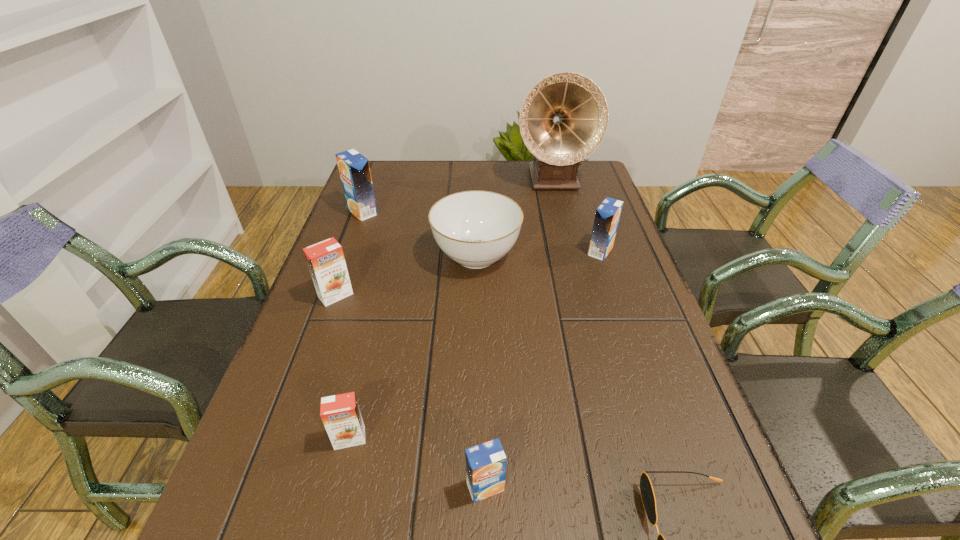
Locate an element on the screen. object that is at the far edge is located at coordinates (563, 119).

Where is `phonograph record at the right edge`? The image size is (960, 540). phonograph record at the right edge is located at coordinates (563, 119).

The width and height of the screenshot is (960, 540). What are the coordinates of `orange_juice that is at the right edge` in the screenshot? It's located at (607, 216).

Locate an element on the screen. The width and height of the screenshot is (960, 540). object present at the far right corner is located at coordinates (563, 119).

I want to click on vacant space at the far edge of the desktop, so click(x=416, y=170).

The image size is (960, 540). In the image, there is a desktop. What are the coordinates of `free space at the left edge` in the screenshot? It's located at (319, 422).

Where is `free space at the right edge`? This screenshot has height=540, width=960. free space at the right edge is located at coordinates pos(637,306).

The image size is (960, 540). What are the coordinates of `free space between the fourth nearest orange_juice and the chinaware` in the screenshot? It's located at (539, 253).

At what (x,y) coordinates should I click in order to perform the action: click on free point between the gray chinaware and the nearest orange_juice. Please return your answer as a coordinate pair (x, y). Looking at the image, I should click on (481, 372).

The image size is (960, 540). In order to click on free space between the chinaware and the nearest blue orange_juice in this screenshot , I will do `click(481, 372)`.